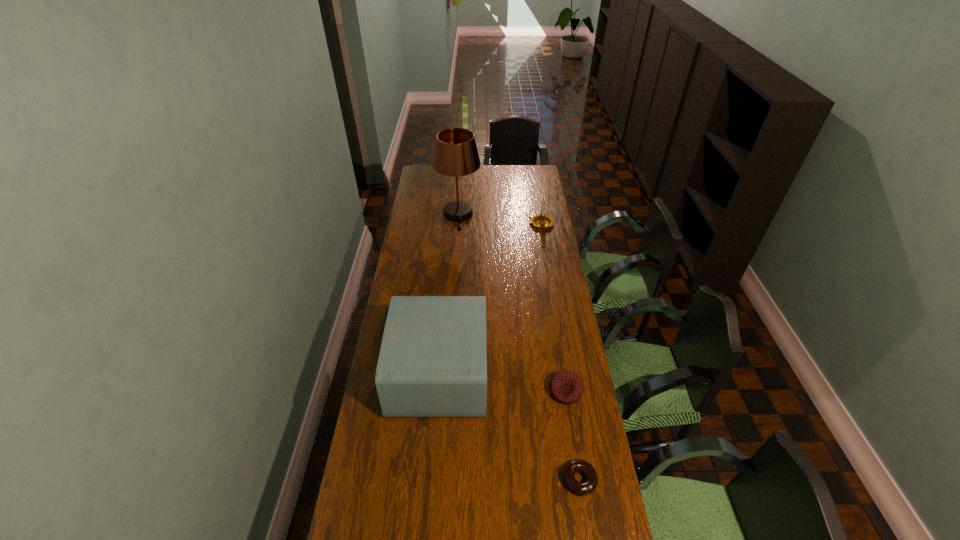
Identify the location of lampshade. Image resolution: width=960 pixels, height=540 pixels. (455, 154).

Where is `the second tallest object`? the second tallest object is located at coordinates (433, 358).

Where is `candle holder`? The image size is (960, 540). candle holder is located at coordinates (542, 220).

Where is `beanbag`? beanbag is located at coordinates (566, 386).

Where is `doughnut`? Image resolution: width=960 pixels, height=540 pixels. doughnut is located at coordinates (584, 488).

At what (x,y) coordinates should I click in order to perform the action: click on the nearest object. Please return your answer as a coordinate pair (x, y). The image size is (960, 540). Looking at the image, I should click on (584, 488).

This screenshot has width=960, height=540. I want to click on free space located 0.160m on the front-facing side of the tallest object, so click(x=456, y=250).

Find the location of a particular element. This screenshot has width=960, height=540. vacant region located on the front panel of the second tallest object is located at coordinates (x=537, y=372).

This screenshot has height=540, width=960. Identify the location of vacant space located on the front of the candle holder. (547, 261).

You are a GUI agent. You are given a task and a screenshot of the screen. Output one action in this format:
    pyautogui.click(x=<x>, y=<y>)
    Task: Click on the blank area located 0.190m on the back of the fourth tallest object
    
    Given the screenshot: What is the action you would take?
    pyautogui.click(x=556, y=335)